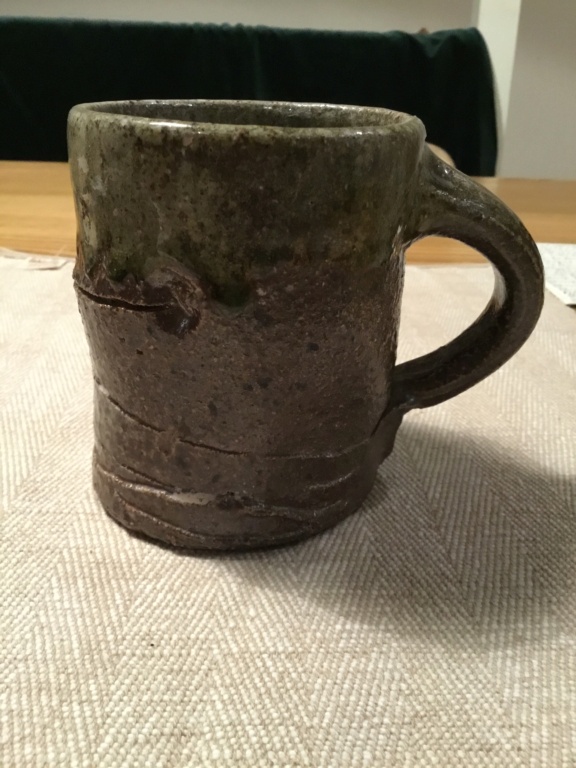
At what (x,y) coordinates should I click in order to perform the action: click on table mat. Please return your answer as a coordinate pair (x, y). Looking at the image, I should click on (310, 636).